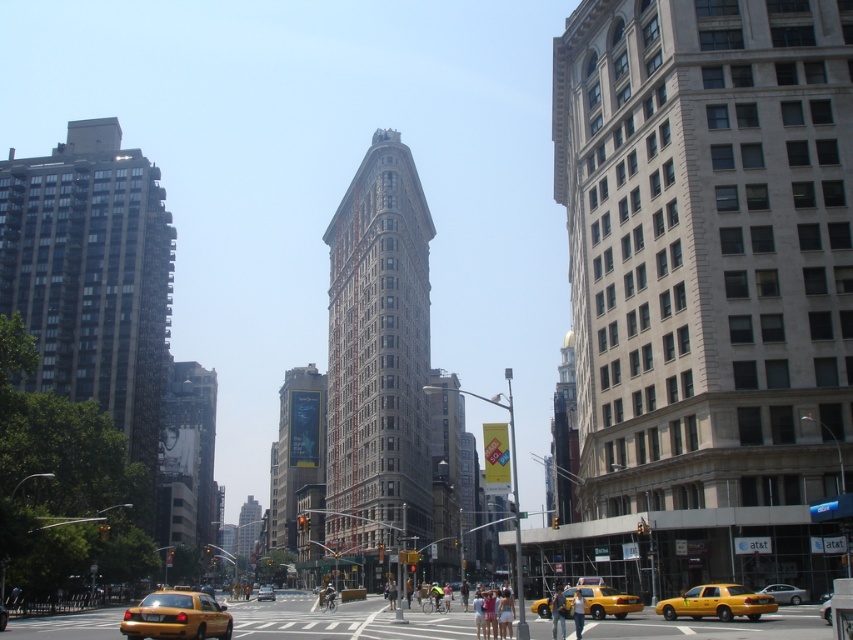
Question: Can you confirm if silver metallic sedan at lower right is bigger than yellow metallic taxi cab at center?

Choices:
 (A) yes
 (B) no

Answer: (B)

Question: Which point is farther to the camera?

Choices:
 (A) (628, 600)
 (B) (263, 588)
 (C) (734, 600)

Answer: (B)

Question: Which point is farther from the camera taking this photo?

Choices:
 (A) (795, 589)
 (B) (260, 588)
 (C) (709, 595)
 (D) (637, 609)

Answer: (B)

Question: Is yellow matte taxi at lower right positioned in front of silver metallic sedan at lower right?

Choices:
 (A) no
 (B) yes

Answer: (B)

Question: Which point is farther to the camera?

Choices:
 (A) (566, 614)
 (B) (795, 588)
 (C) (773, 602)

Answer: (B)

Question: Does yellow rubber taxi at lower left come in front of silver metallic sedan at lower right?

Choices:
 (A) no
 (B) yes

Answer: (B)